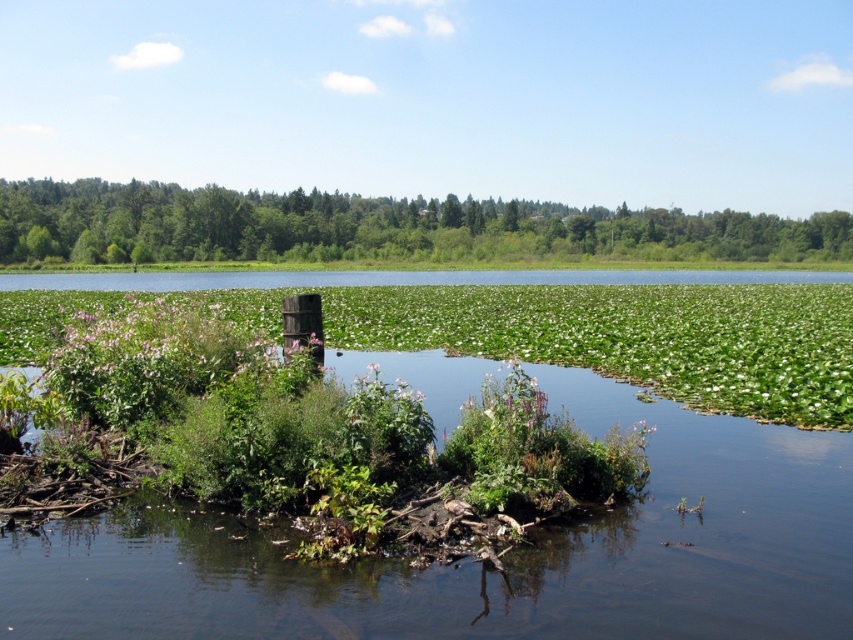
You are a gardener planning to transplant the green leafy plant at center and the green leafy tree at upper center to a new garden. Based on their sizes, which one requires a larger hole in the ground for planting?

The green leafy tree at upper center requires a larger hole because it is thicker than the green leafy plant at center.

In the scene shown: You are a bird flying over the serene natural landscape. You want to land on the closest vegetation to rest. Which one should you choose between the green leafy plant at center and the green leafy tree at upper center?

The green leafy plant at center is shorter than the green leafy tree at upper center, so the green leafy plant at center is closer to the ground and would be easier for the bird to land on.

You are a landscape architect designing a walking path that must pass between the green leafy plant at center and the green leafy tree at upper center. The path must be at least 200 feet wide to accommodate visitors. Based on the scene, can the path be constructed as planned?

The green leafy plant at center and green leafy tree at upper center are 276.01 feet apart, so yes, the path can be constructed as planned since the distance between them is greater than the required 200 feet width.